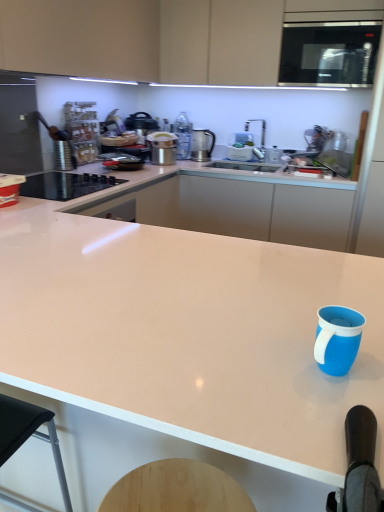
In order to click on free space to the right of blue matte mug at lower right in this screenshot , I will do `click(368, 357)`.